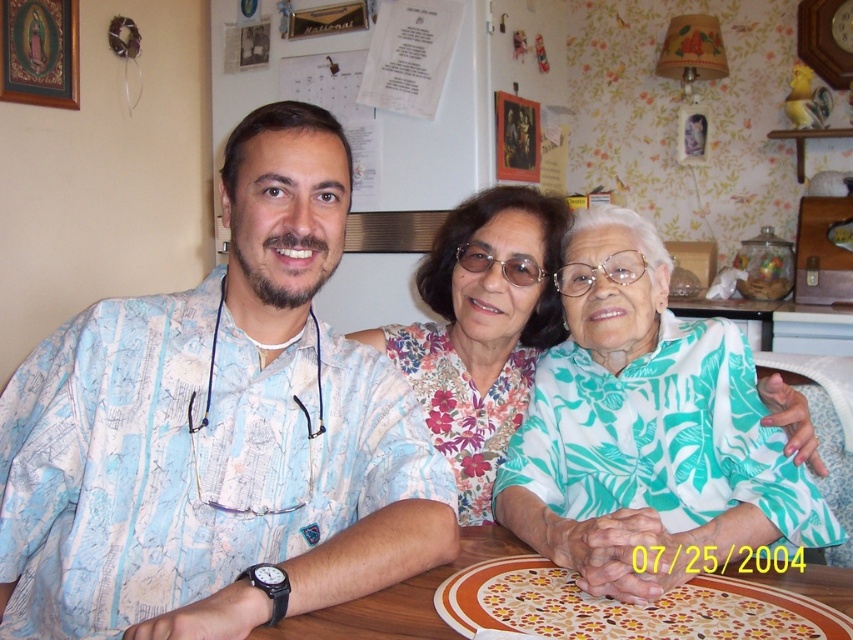
Question: Does teal floral shirt at center appear over wooden table at center?

Choices:
 (A) no
 (B) yes

Answer: (B)

Question: Observing the image, what is the correct spatial positioning of floral fabric blouse at center in reference to wooden table at center?

Choices:
 (A) below
 (B) above

Answer: (B)

Question: Is blue printed shirt at center wider than teal floral shirt at center?

Choices:
 (A) yes
 (B) no

Answer: (A)

Question: Which object is positioned closest to the teal floral shirt at center?

Choices:
 (A) floral fabric blouse at center
 (B) wooden table at center

Answer: (A)

Question: Among these objects, which one is nearest to the camera?

Choices:
 (A) floral fabric blouse at center
 (B) blue printed shirt at center
 (C) teal floral shirt at center
 (D) wooden table at center

Answer: (B)

Question: Which of these objects is positioned closest to the blue printed shirt at center?

Choices:
 (A) wooden table at center
 (B) floral fabric blouse at center
 (C) teal floral shirt at center

Answer: (A)